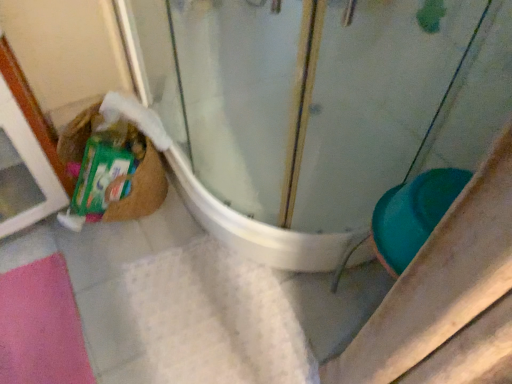
At what (x,y) coordinates should I click in order to perform the action: click on brown woven basket at lower left. Please return your answer as a coordinate pair (x, y). Looking at the image, I should click on (114, 162).

What do you see at coordinates (114, 162) in the screenshot?
I see `brown woven basket at lower left` at bounding box center [114, 162].

Find the location of `brown woven basket at lower left`. brown woven basket at lower left is located at coordinates (114, 162).